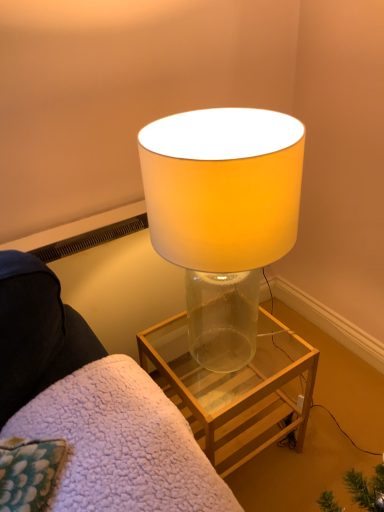
Question: Can you confirm if translucent glass lamp at center is wider than transparent glass lamp at center?

Choices:
 (A) no
 (B) yes

Answer: (A)

Question: From a real-world perspective, does translucent glass lamp at center stand above transparent glass lamp at center?

Choices:
 (A) no
 (B) yes

Answer: (B)

Question: Is translucent glass lamp at center turned away from transparent glass lamp at center?

Choices:
 (A) no
 (B) yes

Answer: (A)

Question: Is the depth of translucent glass lamp at center less than that of transparent glass lamp at center?

Choices:
 (A) yes
 (B) no

Answer: (B)

Question: Is translucent glass lamp at center far from transparent glass lamp at center?

Choices:
 (A) yes
 (B) no

Answer: (B)

Question: In terms of size, does translucent glass lamp at center appear bigger or smaller than clear glass table at center?

Choices:
 (A) big
 (B) small

Answer: (A)

Question: Considering the positions of point (233, 336) and point (223, 380), is point (233, 336) closer or farther from the camera than point (223, 380)?

Choices:
 (A) farther
 (B) closer

Answer: (A)

Question: From a real-world perspective, is translucent glass lamp at center physically located above or below clear glass table at center?

Choices:
 (A) below
 (B) above

Answer: (B)

Question: Is translucent glass lamp at center wider or thinner than clear glass table at center?

Choices:
 (A) wide
 (B) thin

Answer: (B)

Question: Which is correct: clear glass table at center is inside translucent glass lamp at center, or outside of it?

Choices:
 (A) outside
 (B) inside

Answer: (A)

Question: From a real-world perspective, relative to translucent glass lamp at center, is clear glass table at center vertically above or below?

Choices:
 (A) below
 (B) above

Answer: (A)

Question: Considering their positions, is clear glass table at center located in front of or behind translucent glass lamp at center?

Choices:
 (A) front
 (B) behind

Answer: (B)

Question: Based on their sizes in the image, would you say clear glass table at center is bigger or smaller than translucent glass lamp at center?

Choices:
 (A) small
 (B) big

Answer: (A)

Question: From the image's perspective, relative to clear glass table at center, is transparent glass lamp at center above or below?

Choices:
 (A) above
 (B) below

Answer: (B)

Question: Choose the correct answer: Is transparent glass lamp at center inside clear glass table at center or outside it?

Choices:
 (A) outside
 (B) inside

Answer: (A)